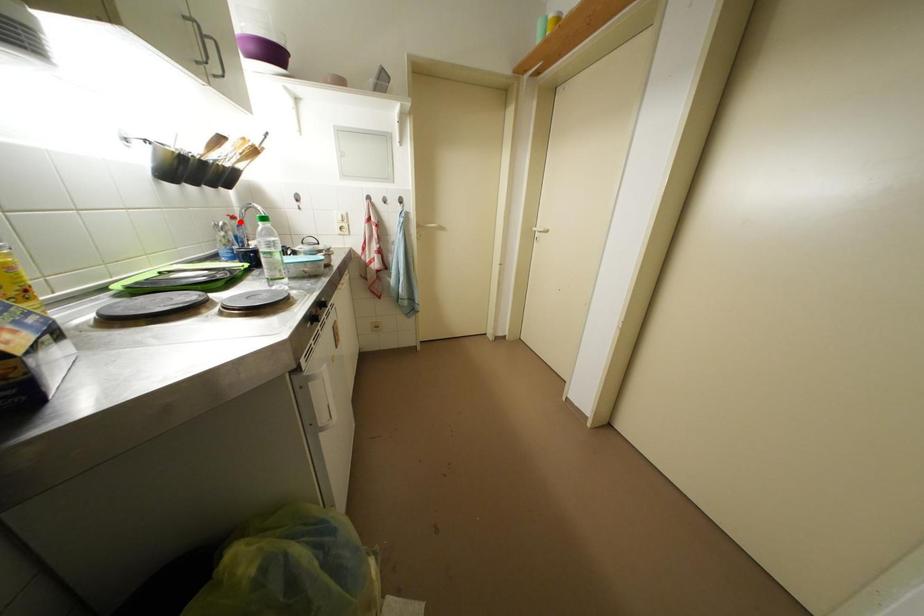
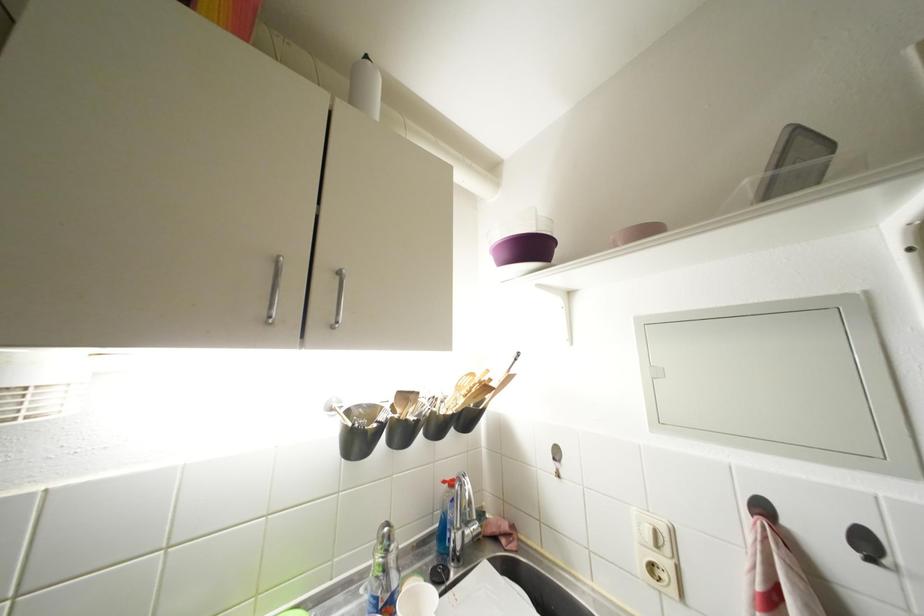
Find the pixel in the second image that matches the highlighted location in the first image.

(457, 488)